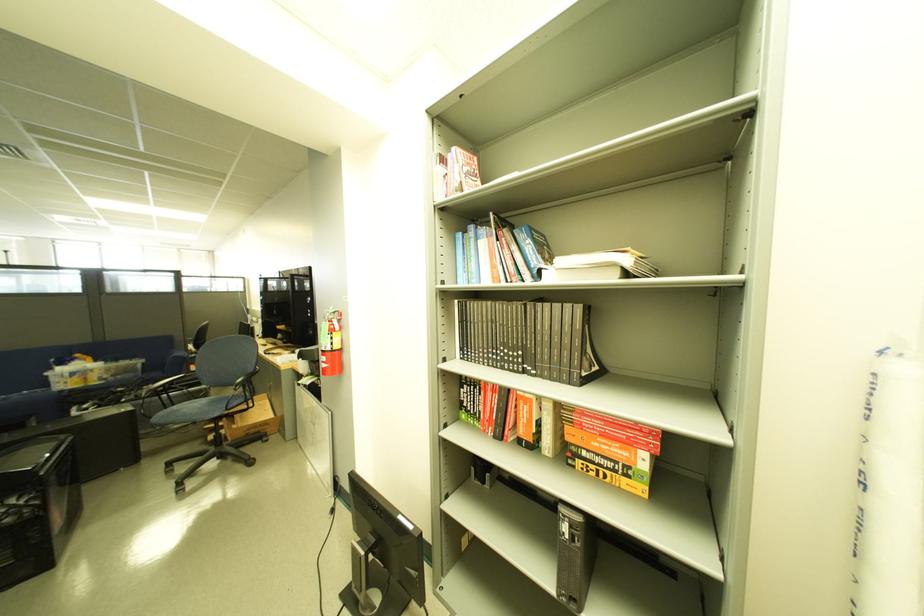
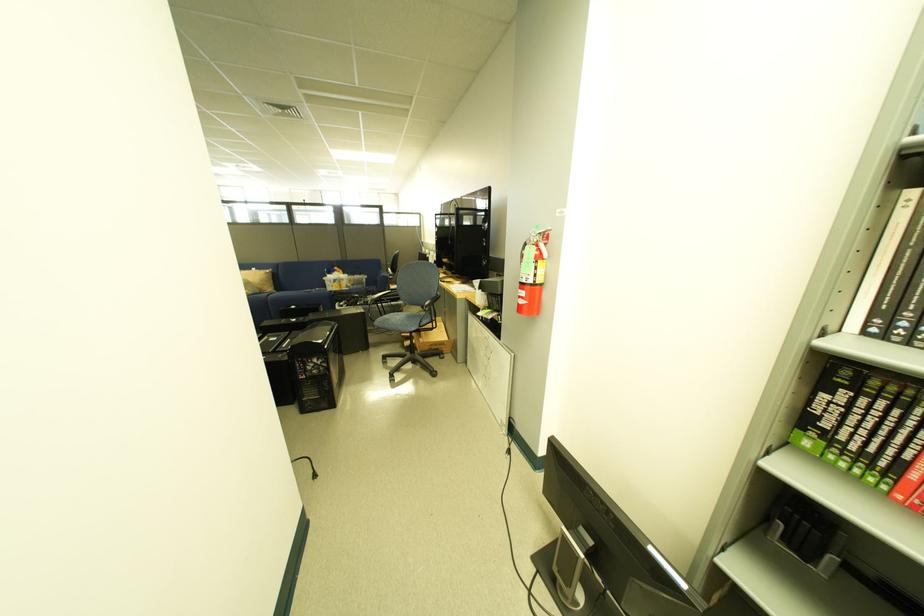
Question: Based on the continuous images, in which direction is the camera rotating? Reply with the corresponding letter.

Choices:
 (A) Left
 (B) Right
 (C) Up
 (D) Down

Answer: (A)